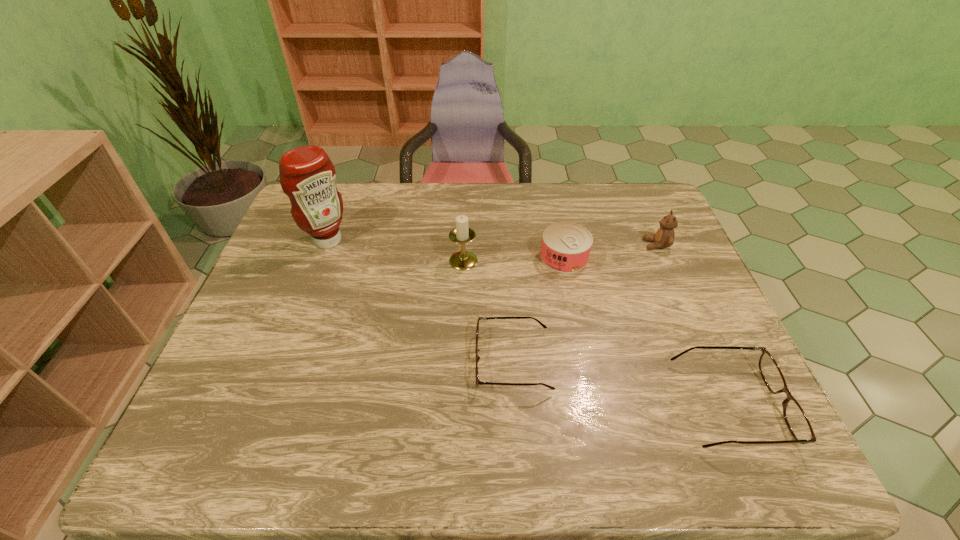
With all spectacless evenly spaced, where should an extra spectacles be placed on the left to continue the pattern? Please point out a vacant space. Please provide its 2D coordinates. Your answer should be formatted as a tuple, i.e. [(x, y)], where the tuple contains the x and y coordinates of a point satisfying the conditions above.

[(326, 323)]